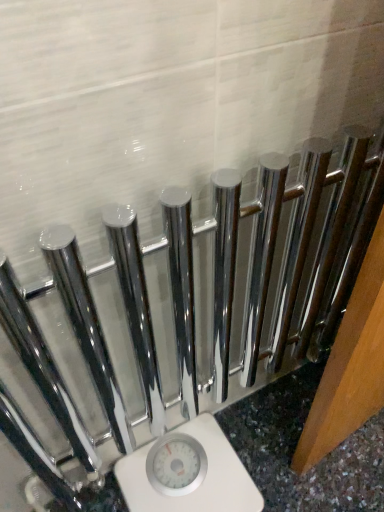
What do you see at coordinates (188, 473) in the screenshot?
I see `white plastic scale at lower center` at bounding box center [188, 473].

In order to face white plastic scale at lower center, should I rotate leftwards or rightwards?

Rotate left and turn 0.689 degrees.

In order to click on white plastic scale at lower center in this screenshot , I will do `click(188, 473)`.

I want to click on white plastic scale at lower center, so click(x=188, y=473).